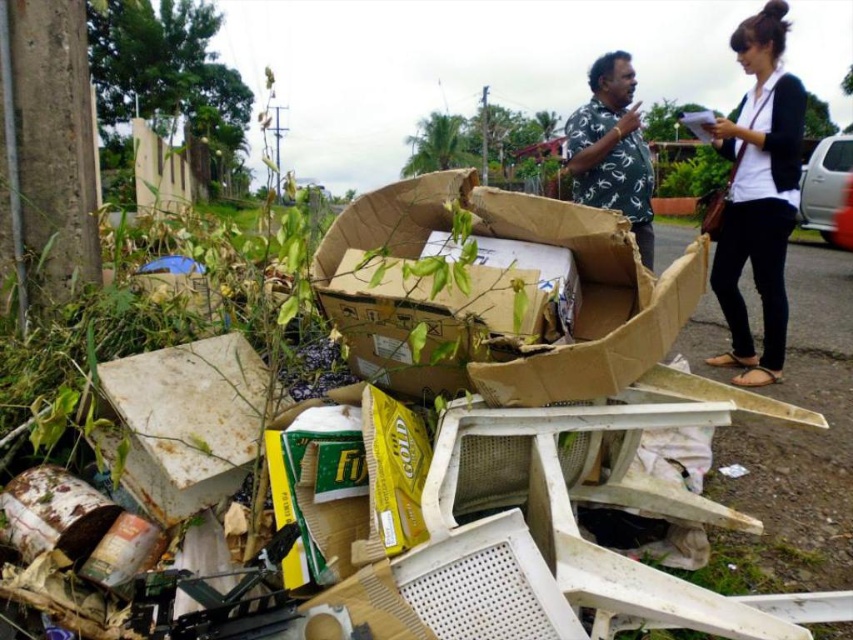
Question: Is white matte shirt at upper right wider than white printed shirt at upper center?

Choices:
 (A) yes
 (B) no

Answer: (B)

Question: Considering the real-world distances, which object is closest to the white printed shirt at upper center?

Choices:
 (A) white matte shirt at upper right
 (B) brown cardboard box at center

Answer: (B)

Question: From the image, what is the correct spatial relationship of brown cardboard box at center in relation to white printed shirt at upper center?

Choices:
 (A) right
 (B) left

Answer: (B)

Question: Does brown cardboard box at center appear on the left side of white matte shirt at upper right?

Choices:
 (A) yes
 (B) no

Answer: (A)

Question: Which object appears farthest from the camera in this image?

Choices:
 (A) brown cardboard box at center
 (B) white matte shirt at upper right

Answer: (B)

Question: Which of these objects is positioned closest to the white printed shirt at upper center?

Choices:
 (A) white matte shirt at upper right
 (B) brown cardboard box at center

Answer: (B)